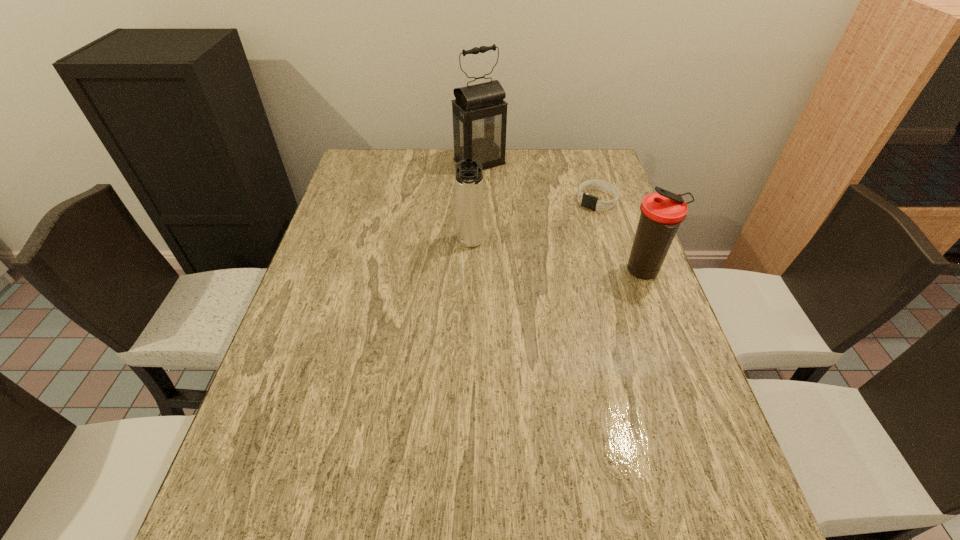
Where is `blank space located 0.350m on the outer surface of the wristband`? blank space located 0.350m on the outer surface of the wristband is located at coordinates click(523, 272).

Where is `vacant space located on the front-facing side of the tallest object`? The width and height of the screenshot is (960, 540). vacant space located on the front-facing side of the tallest object is located at coordinates (519, 201).

Identify the location of vacant space situated 0.170m on the front-facing side of the tallest object. The width and height of the screenshot is (960, 540). click(517, 199).

Where is `free space located 0.350m on the front-facing side of the tallest object`? This screenshot has height=540, width=960. free space located 0.350m on the front-facing side of the tallest object is located at coordinates (550, 232).

Locate an element on the screen. This screenshot has width=960, height=540. object present at the far edge is located at coordinates (479, 112).

At what (x,y) coordinates should I click in order to perform the action: click on thermos bottle that is positioned at the right edge. Please return your answer as a coordinate pair (x, y). The width and height of the screenshot is (960, 540). Looking at the image, I should click on (661, 213).

Locate an element on the screen. wristband present at the right edge is located at coordinates (591, 202).

Find the location of `vacant space at the far edge`. vacant space at the far edge is located at coordinates (485, 179).

Identify the location of free spot at the near edge of the desktop. This screenshot has width=960, height=540. (419, 478).

Identify the location of free space at the left edge. (355, 335).